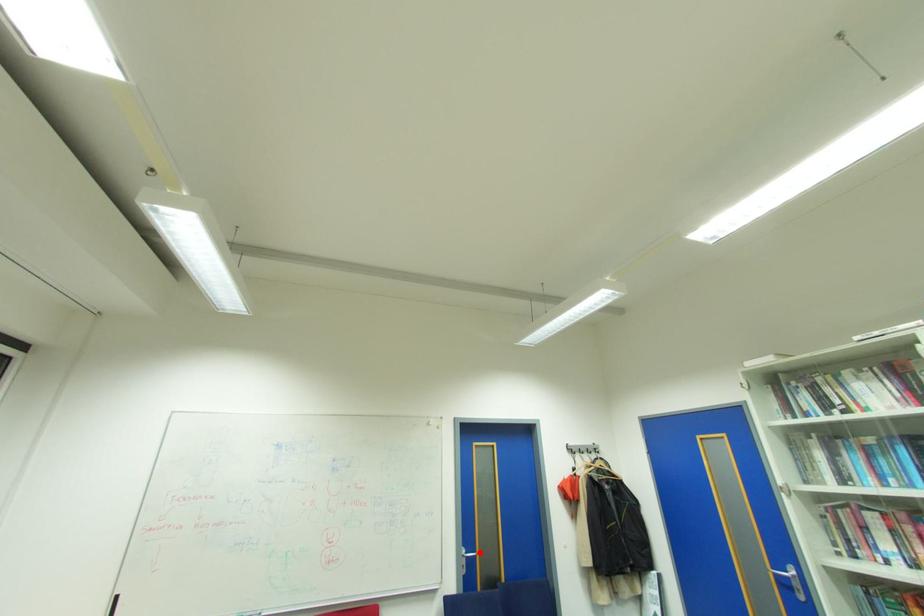
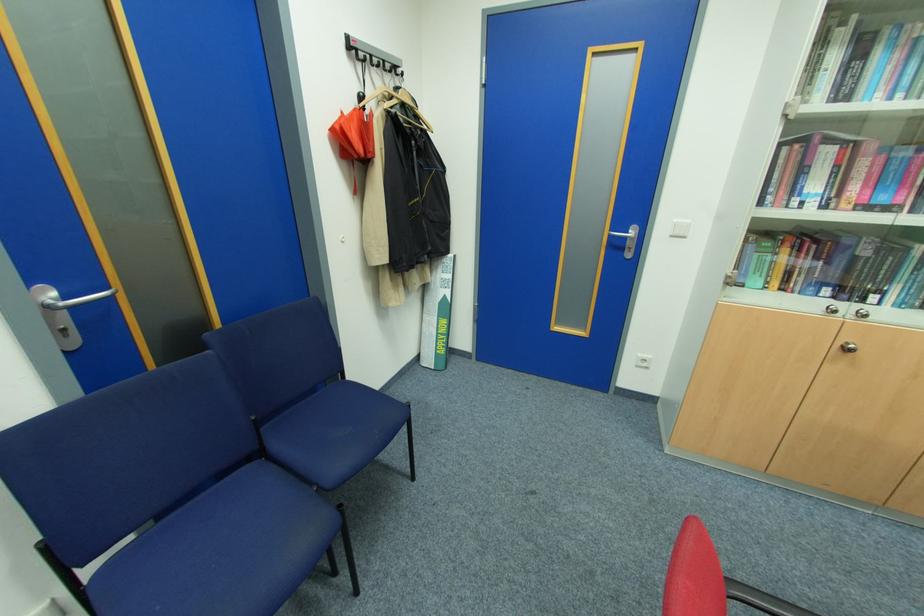
Where in the second image is the point corresponding to the highlighted location from the first image?

(113, 288)